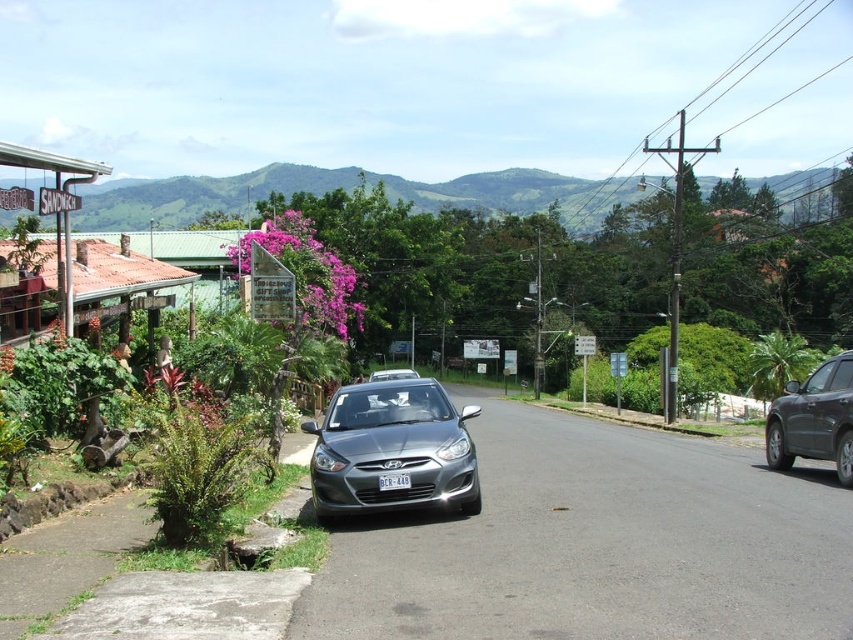
Measure the distance between green leafy mountain at upper center and camera.

green leafy mountain at upper center is 13.29 meters from camera.

Does point (252, 172) come in front of point (387, 481)?

No, (252, 172) is behind (387, 481).

At what (x,y) coordinates should I click in order to perform the action: click on green leafy mountain at upper center. Please return your answer as a coordinate pair (x, y). Image resolution: width=853 pixels, height=640 pixels. Looking at the image, I should click on (347, 188).

Does green leafy mountain at upper center have a lesser height compared to satin black suv at right?

No.

Between green leafy mountain at upper center and satin black suv at right, which one appears on the right side from the viewer's perspective?

green leafy mountain at upper center is more to the right.

Measure the distance between green leafy mountain at upper center and camera.

They are 43.60 feet apart.

Where is `green leafy mountain at upper center`? green leafy mountain at upper center is located at coordinates (347, 188).

Who is lower down, satin metallic sedan at center or satin black suv at right?

satin metallic sedan at center is lower down.

Between point (351, 406) and point (782, 396), which one is positioned in front?

Point (351, 406)

Image resolution: width=853 pixels, height=640 pixels. I want to click on satin metallic sedan at center, so click(392, 449).